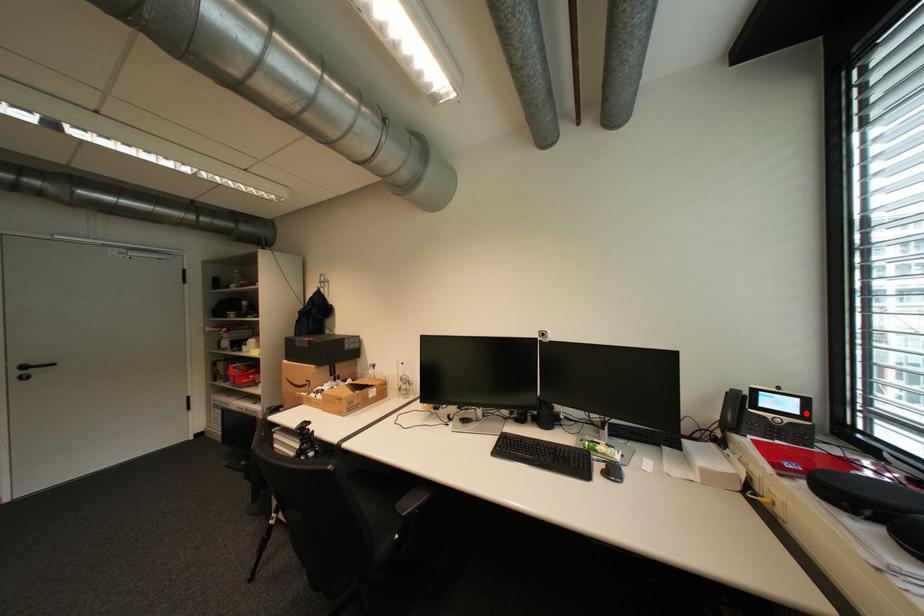
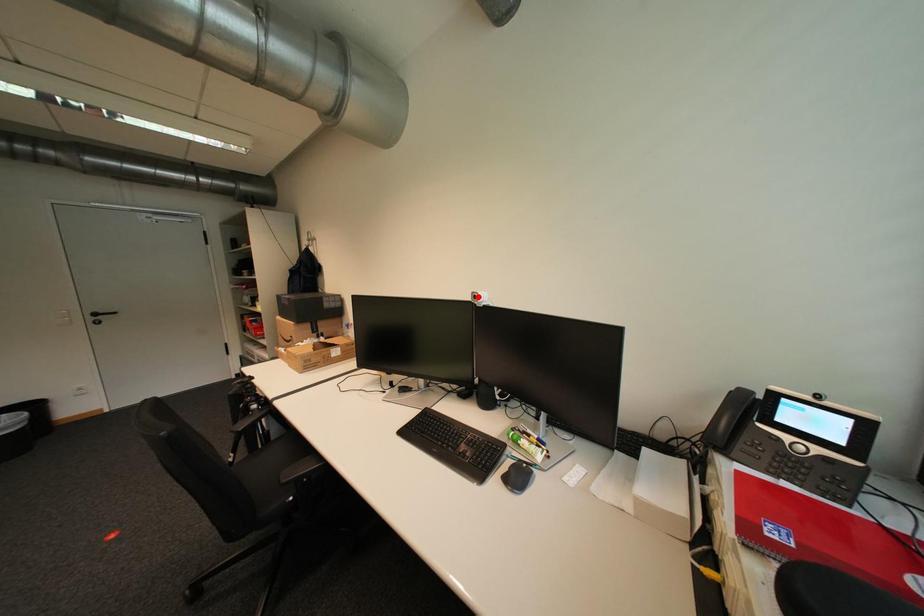
I am providing you with two images of the same scene from different viewpoints. A red point is marked on the first image and another point is marked on the second image. Is the red point in image1 aligned with the point shown in image2?

No